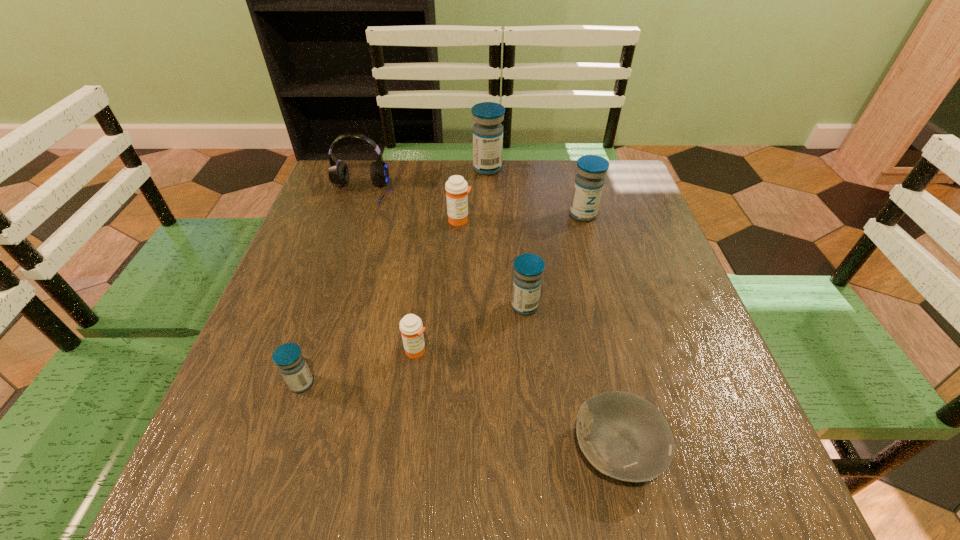
Identify the location of object positioned at the far right corner. This screenshot has height=540, width=960. (589, 182).

Where is `object located in the near right corner section of the desktop`? The image size is (960, 540). object located in the near right corner section of the desktop is located at coordinates [624, 436].

Locate an element on the screen. The height and width of the screenshot is (540, 960). free space at the far edge of the desktop is located at coordinates (548, 165).

Where is `vacant space at the near edge`? This screenshot has height=540, width=960. vacant space at the near edge is located at coordinates (384, 460).

This screenshot has height=540, width=960. I want to click on vacant space at the left edge, so click(x=321, y=249).

This screenshot has height=540, width=960. In the image, there is a desktop. Identify the location of free region at the right edge. (675, 412).

In the image, there is a desktop. Identify the location of vacant space at the far left corner. The height and width of the screenshot is (540, 960). (357, 179).

The height and width of the screenshot is (540, 960). In order to click on free space between the third object from left to right and the right orange medicine in this screenshot , I will do `click(438, 285)`.

Find the location of a particular element. vacant area between the seventh farthest object and the farthest object is located at coordinates (395, 276).

Locate an element on the screen. The image size is (960, 540). vacant area between the bigger orange medicine and the gray bowl is located at coordinates (539, 334).